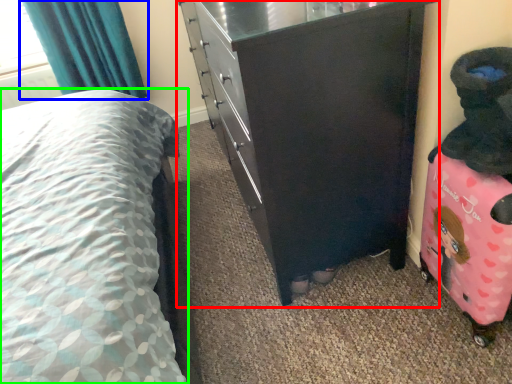
Question: Considering the real-world distances, which object is closest to chest of drawers (highlighted by a red box)? curtain (highlighted by a blue box) or bed (highlighted by a green box).

Choices:
 (A) curtain
 (B) bed

Answer: (B)